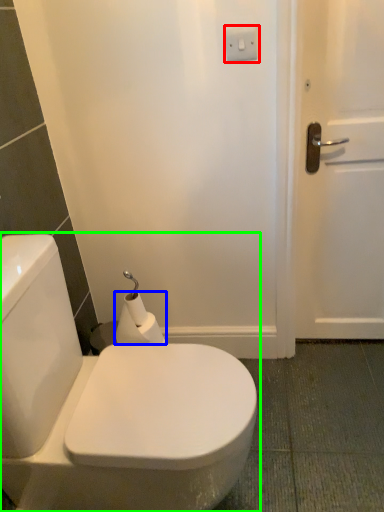
Question: Which object is the closest to the electric outlet (highlighted by a red box)? Choose among these: toilet paper (highlighted by a blue box) or toilet (highlighted by a green box).

Choices:
 (A) toilet paper
 (B) toilet

Answer: (A)